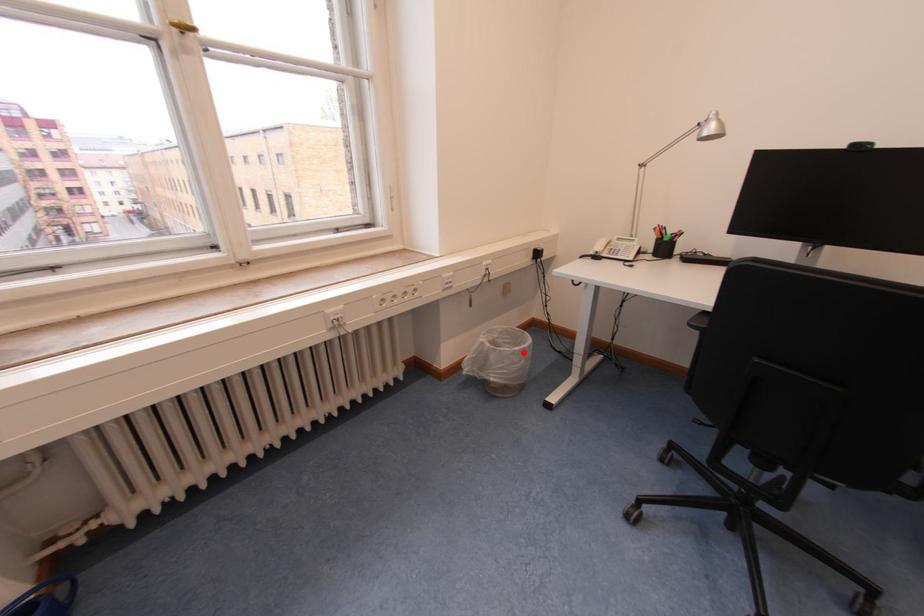
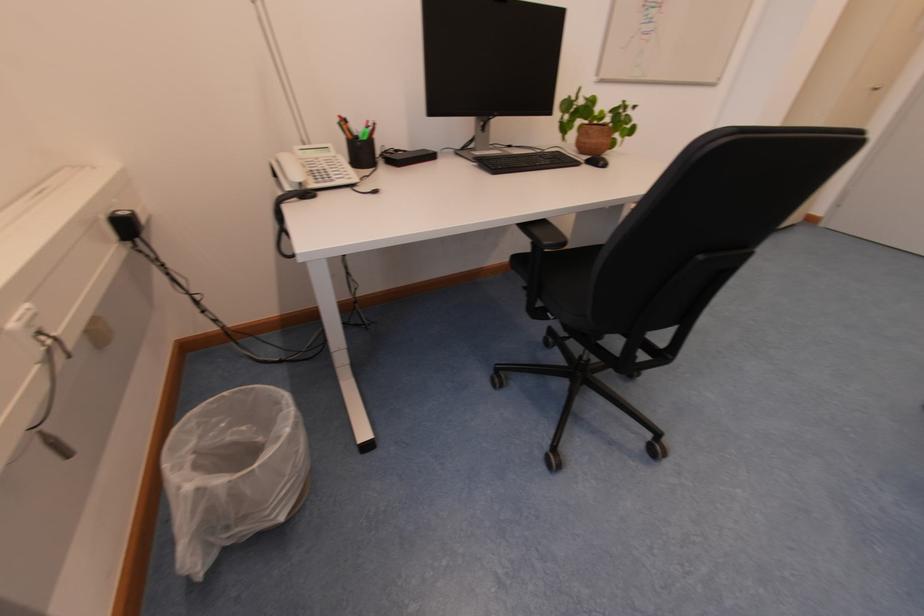
Question: I am providing you with two images of the same scene from different viewpoints. Image1 has a red point marked. In image2, the corresponding 3D location appears at what relative position? Reply with the corresponding letter.

Choices:
 (A) Closer
 (B) Farther

Answer: (B)